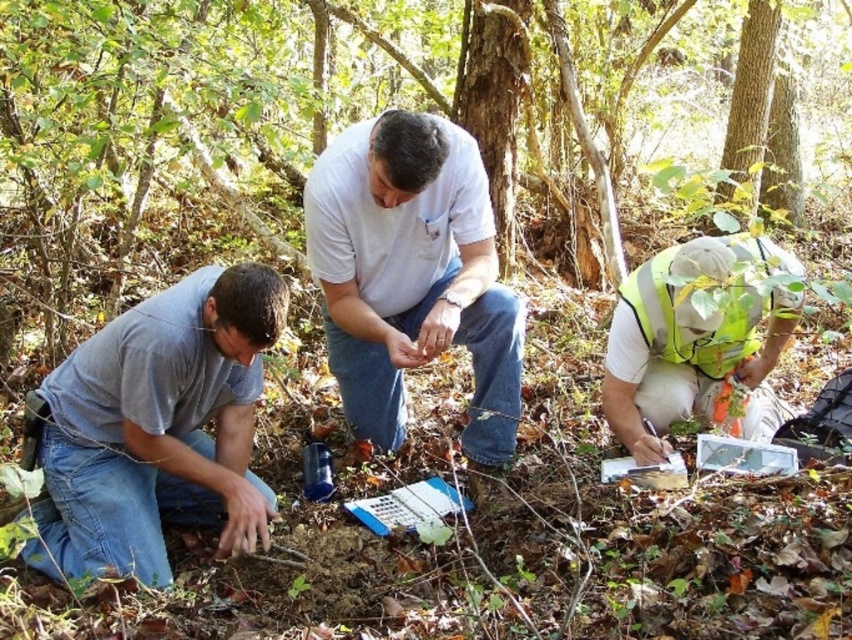
Question: Does white matte shirt at center appear under reflective yellow vest at lower right?

Choices:
 (A) yes
 (B) no

Answer: (B)

Question: Among these objects, which one is nearest to the camera?

Choices:
 (A) gray matte shirt at lower left
 (B) white matte shirt at center
 (C) reflective yellow vest at lower right

Answer: (A)

Question: Which point appears farthest from the camera in this image?

Choices:
 (A) (170, 576)
 (B) (694, 256)

Answer: (B)

Question: Estimate the real-world distances between objects in this image. Which object is closer to the gray matte shirt at lower left?

Choices:
 (A) white matte shirt at center
 (B) reflective yellow vest at lower right

Answer: (A)

Question: Is gray matte shirt at lower left further to the viewer compared to white matte shirt at center?

Choices:
 (A) yes
 (B) no

Answer: (B)

Question: Where is gray matte shirt at lower left located in relation to reflective yellow vest at lower right in the image?

Choices:
 (A) above
 (B) below

Answer: (B)